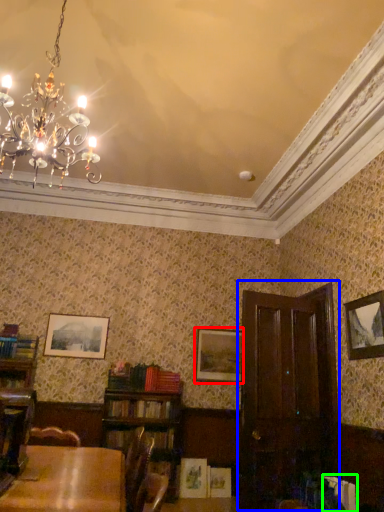
Question: Considering the real-world distances, which object is closest to picture frame (highlighted by a red box)? armoire (highlighted by a blue box) or book (highlighted by a green box).

Choices:
 (A) armoire
 (B) book

Answer: (A)